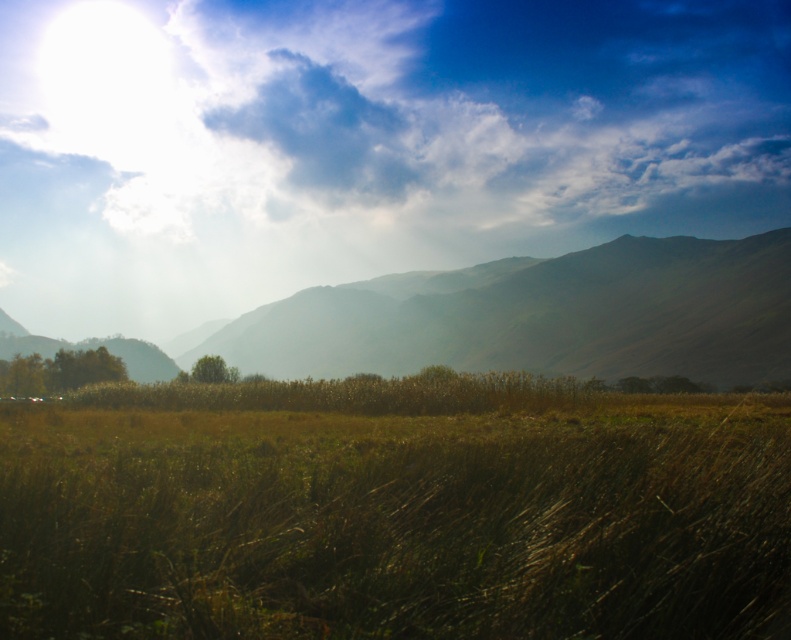
Question: Which point is farther from the camera taking this photo?

Choices:
 (A) (682, 212)
 (B) (651, 339)

Answer: (A)

Question: Is brown dry grass at center wider than green matte mountain at center?

Choices:
 (A) no
 (B) yes

Answer: (A)

Question: Is white fluffy cloud at upper center thinner than brown dry grass at center?

Choices:
 (A) yes
 (B) no

Answer: (B)

Question: Which is farther from the brown dry grass at center?

Choices:
 (A) green matte mountain at center
 (B) white fluffy cloud at upper center

Answer: (B)

Question: Which object appears farthest from the camera in this image?

Choices:
 (A) white fluffy cloud at upper center
 (B) green matte mountain at center

Answer: (A)

Question: Can you confirm if brown dry grass at center is wider than green matte mountain at center?

Choices:
 (A) yes
 (B) no

Answer: (B)